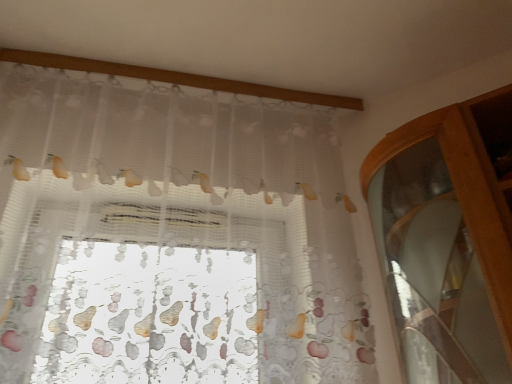
The width and height of the screenshot is (512, 384). In order to click on translucent floral-patterned curtain at center in this screenshot , I will do `click(173, 237)`.

The image size is (512, 384). What do you see at coordinates (173, 237) in the screenshot?
I see `translucent floral-patterned curtain at center` at bounding box center [173, 237].

In order to face translucent floral-patterned curtain at center, should I rotate leftwards or rightwards?

You should look left and rotate roughly 10.283 degrees.

You are a GUI agent. You are given a task and a screenshot of the screen. Output one action in this format:
    pyautogui.click(x=<x>, y=<y>)
    Task: Click on the translucent floral-patterned curtain at center
    The height and width of the screenshot is (384, 512).
    Given the screenshot: What is the action you would take?
    pyautogui.click(x=173, y=237)